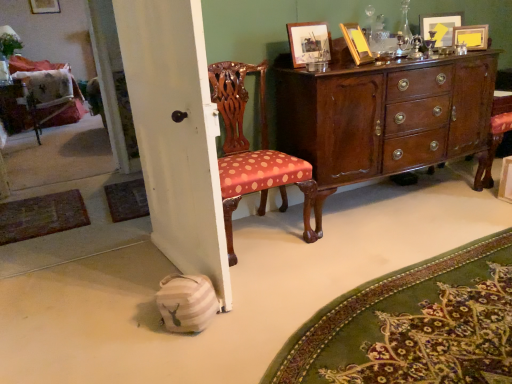
Where is `vacant region to the right of white painted wood door at lower left`? vacant region to the right of white painted wood door at lower left is located at coordinates (285, 271).